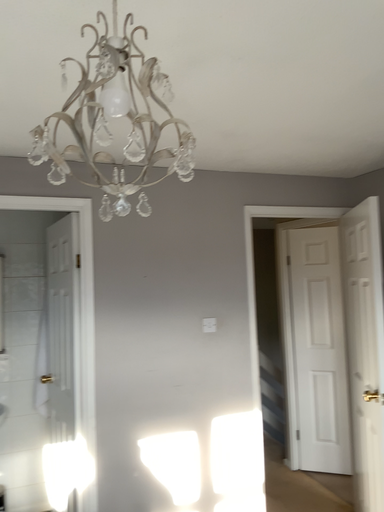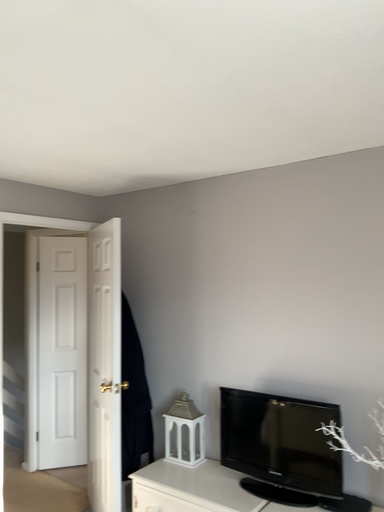
Question: How did the camera likely rotate when shooting the video?

Choices:
 (A) rotated left
 (B) rotated right

Answer: (B)